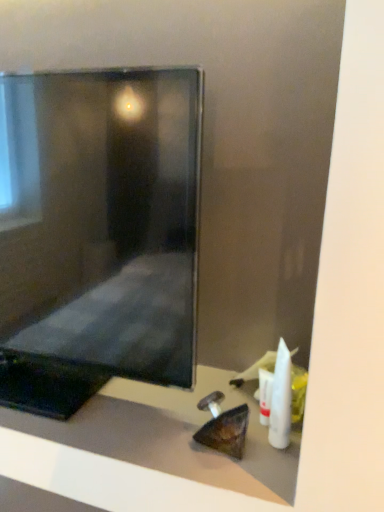
At what (x,y) coordinates should I click in order to perform the action: click on free space to the left of white plastic tube at lower right, the second toiletry viewed from the front. Please return your answer as a coordinate pair (x, y). The width and height of the screenshot is (384, 512). Looking at the image, I should click on (178, 422).